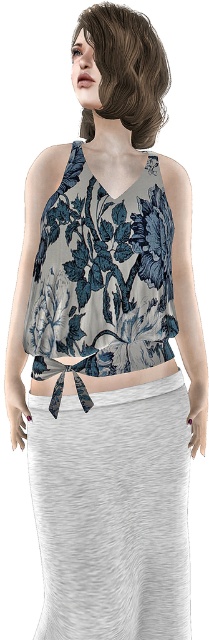
Question: Can you confirm if brown matte hair at upper center is smaller than floral fabric top at center?

Choices:
 (A) yes
 (B) no

Answer: (B)

Question: Which of the following is the farthest from the observer?

Choices:
 (A) brown matte hair at upper center
 (B) floral fabric top at center
 (C) floral-patterned fabric top at center

Answer: (B)

Question: Does brown matte hair at upper center appear on the left side of floral fabric top at center?

Choices:
 (A) yes
 (B) no

Answer: (B)

Question: Which of the following is the closest to the observer?

Choices:
 (A) brown matte hair at upper center
 (B) floral-patterned fabric top at center

Answer: (B)

Question: Is floral-patterned fabric top at center closer to the viewer compared to brown matte hair at upper center?

Choices:
 (A) yes
 (B) no

Answer: (A)

Question: Which is farther from the floral-patterned fabric top at center?

Choices:
 (A) floral fabric top at center
 (B) brown matte hair at upper center

Answer: (B)